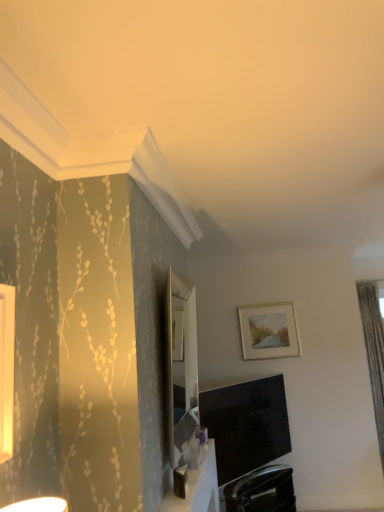
Question: Is white glossy table at lower center further to the viewer compared to matte white picture frame at upper right?

Choices:
 (A) no
 (B) yes

Answer: (A)

Question: Can you confirm if white glossy table at lower center is thinner than matte white picture frame at upper right?

Choices:
 (A) no
 (B) yes

Answer: (A)

Question: Is white glossy table at lower center oriented away from matte white picture frame at upper right?

Choices:
 (A) yes
 (B) no

Answer: (B)

Question: Considering the relative sizes of white glossy table at lower center and matte white picture frame at upper right in the image provided, is white glossy table at lower center taller than matte white picture frame at upper right?

Choices:
 (A) no
 (B) yes

Answer: (A)

Question: From a real-world perspective, is white glossy table at lower center over matte white picture frame at upper right?

Choices:
 (A) yes
 (B) no

Answer: (B)

Question: Which is correct: black leather swivel chair at lower center is inside white glossy table at lower center, or outside of it?

Choices:
 (A) inside
 (B) outside

Answer: (B)

Question: Looking at their shapes, would you say black leather swivel chair at lower center is wider or thinner than white glossy table at lower center?

Choices:
 (A) wide
 (B) thin

Answer: (A)

Question: Considering their positions, is black leather swivel chair at lower center located in front of or behind white glossy table at lower center?

Choices:
 (A) front
 (B) behind

Answer: (B)

Question: Is point (228, 486) closer or farther from the camera than point (192, 480)?

Choices:
 (A) farther
 (B) closer

Answer: (A)

Question: Considering the relative positions of matte white picture frame at upper right and white glossy table at lower center in the image provided, is matte white picture frame at upper right to the left or to the right of white glossy table at lower center?

Choices:
 (A) left
 (B) right

Answer: (B)

Question: From a real-world perspective, is matte white picture frame at upper right above or below white glossy table at lower center?

Choices:
 (A) below
 (B) above

Answer: (B)

Question: From the image's perspective, is matte white picture frame at upper right above or below white glossy table at lower center?

Choices:
 (A) below
 (B) above

Answer: (B)

Question: Considering the positions of point (256, 334) and point (198, 498), is point (256, 334) closer or farther from the camera than point (198, 498)?

Choices:
 (A) closer
 (B) farther

Answer: (B)

Question: Is white glossy table at lower center situated inside matte black tv at lower center or outside?

Choices:
 (A) inside
 (B) outside

Answer: (B)

Question: In the image, is white glossy table at lower center positioned in front of or behind matte black tv at lower center?

Choices:
 (A) behind
 (B) front

Answer: (B)